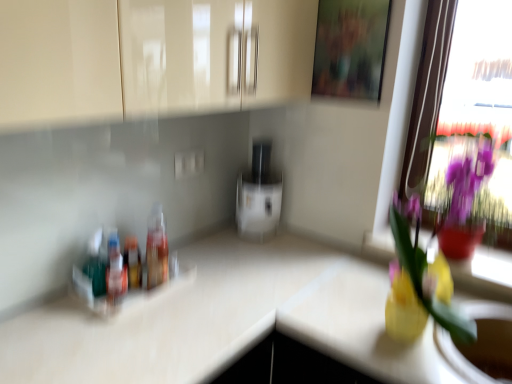
Question: Considering the relative sizes of translucent plastic bottles at left, the first bottle when ordered from left to right, and yellow glass vase at right in the image provided, is translucent plastic bottles at left, the first bottle when ordered from left to right, bigger than yellow glass vase at right?

Choices:
 (A) no
 (B) yes

Answer: (A)

Question: Is translucent plastic bottles at left, acting as the third bottle starting from the right, to the right of yellow glass vase at right from the viewer's perspective?

Choices:
 (A) no
 (B) yes

Answer: (A)

Question: Is translucent plastic bottles at left, acting as the third bottle starting from the right, aimed at yellow glass vase at right?

Choices:
 (A) no
 (B) yes

Answer: (A)

Question: From the image's perspective, is translucent plastic bottles at left, acting as the third bottle starting from the right, under yellow glass vase at right?

Choices:
 (A) yes
 (B) no

Answer: (A)

Question: Is translucent plastic bottles at left, the first bottle when ordered from left to right, behind yellow glass vase at right?

Choices:
 (A) yes
 (B) no

Answer: (A)

Question: Is translucent plastic bottles at left, the first bottle when ordered from left to right, taller than yellow glass vase at right?

Choices:
 (A) no
 (B) yes

Answer: (A)

Question: Is yellow glass vase at upper right inside yellow glass vase at right?

Choices:
 (A) yes
 (B) no

Answer: (B)

Question: Is yellow glass vase at right oriented towards yellow glass vase at upper right?

Choices:
 (A) no
 (B) yes

Answer: (A)

Question: From the image's perspective, does yellow glass vase at right appear lower than yellow glass vase at upper right?

Choices:
 (A) no
 (B) yes

Answer: (A)

Question: Does yellow glass vase at right have a lesser width compared to yellow glass vase at upper right?

Choices:
 (A) no
 (B) yes

Answer: (A)

Question: Considering the relative sizes of yellow glass vase at right and yellow glass vase at upper right in the image provided, is yellow glass vase at right wider than yellow glass vase at upper right?

Choices:
 (A) yes
 (B) no

Answer: (A)

Question: Is yellow glass vase at right taller than yellow glass vase at upper right?

Choices:
 (A) no
 (B) yes

Answer: (B)

Question: Is translucent plastic bottles at left, the first bottle when ordered from left to right, positioned behind wooden frame at upper center?

Choices:
 (A) no
 (B) yes

Answer: (A)